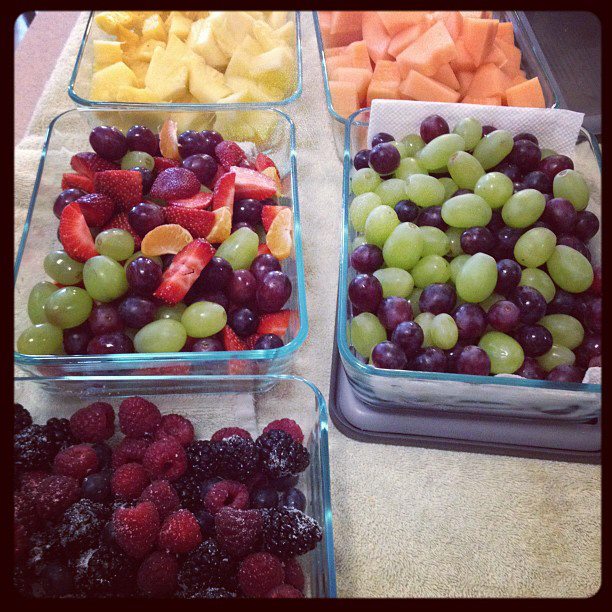
You are a GUI agent. You are given a task and a screenshot of the screen. Output one action in this format:
    pyautogui.click(x=<x>, y=<y>)
    Task: Click on the bowl
    The height and width of the screenshot is (612, 612).
    Given the screenshot: What is the action you would take?
    pyautogui.click(x=273, y=127)